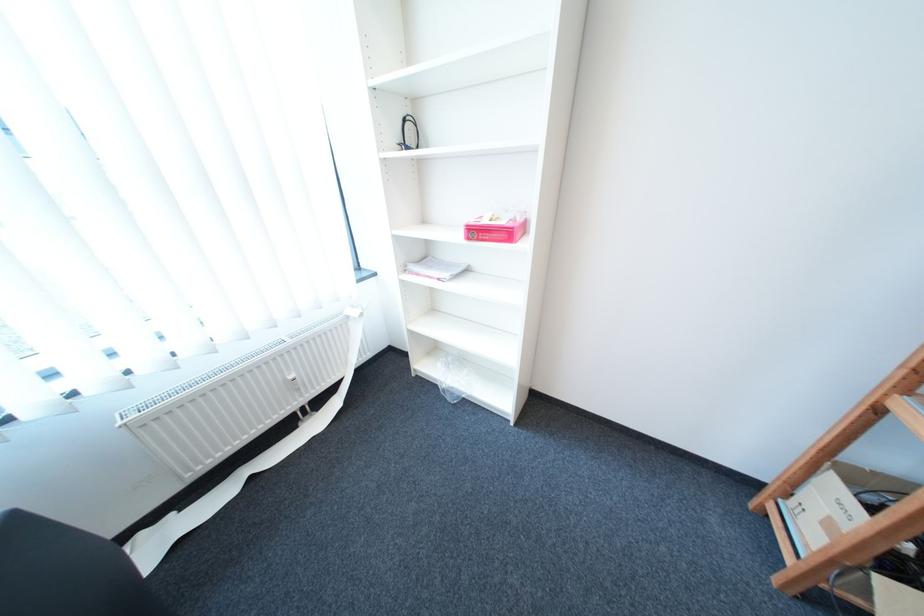
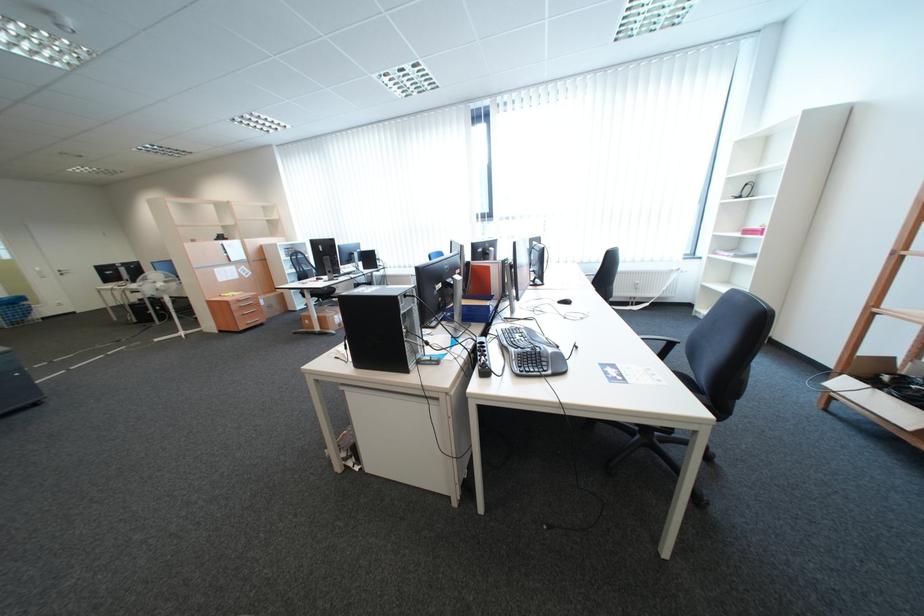
Locate, in the second image, the point that corresponds to pixel 426 377 in the first image.

(704, 315)